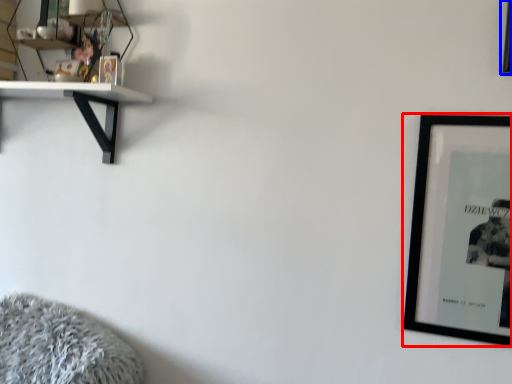
Question: Among these objects, which one is nearest to the camera, picture frame (highlighted by a red box) or picture frame (highlighted by a blue box)?

Choices:
 (A) picture frame
 (B) picture frame

Answer: (B)